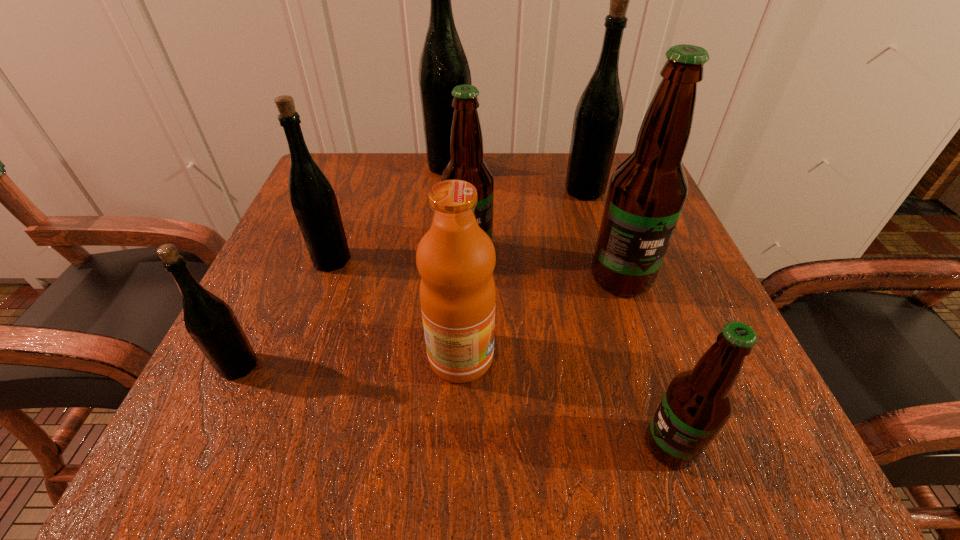
The height and width of the screenshot is (540, 960). I want to click on the leftmost green beer bottle, so click(x=212, y=324).

Where is `the nearest object`? the nearest object is located at coordinates (698, 402).

Locate an element on the screen. The width and height of the screenshot is (960, 540). the nearest brown beer bottle is located at coordinates (698, 402).

This screenshot has width=960, height=540. What are the coordinates of `free space located 0.160m on the front of the farthest object` in the screenshot? It's located at click(x=444, y=221).

What are the coordinates of `vacant point located on the front of the second farthest green beer bottle` in the screenshot? It's located at (620, 307).

This screenshot has height=540, width=960. I want to click on blank space located on the label of the biggest brown beer bottle, so click(659, 390).

This screenshot has height=540, width=960. In order to click on free region located 0.100m on the right of the third green beer bottle from right to left in this screenshot , I will do pos(407,260).

What are the coordinates of `vacant space located 0.230m on the label of the leftmost brown beer bottle` in the screenshot? It's located at (466, 374).

Where is `free space located 0.150m on the label side of the fruit juice`? free space located 0.150m on the label side of the fruit juice is located at coordinates (595, 357).

Locate an element on the screen. This screenshot has height=540, width=960. vacant space located 0.240m on the right of the leftmost beer bottle is located at coordinates (423, 366).